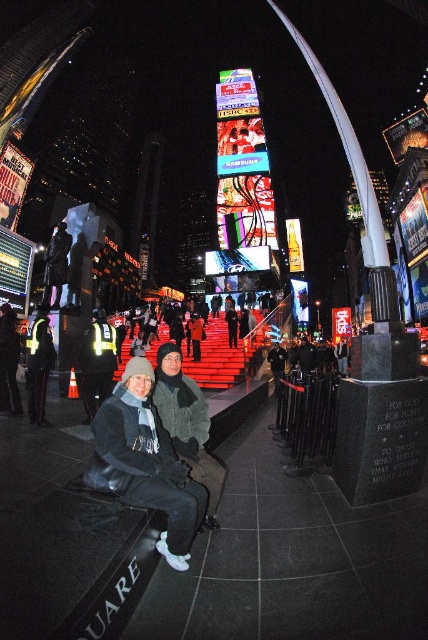
Question: Is dark gray knit hat at lower center positioned before reflective yellow vest at lower left?

Choices:
 (A) yes
 (B) no

Answer: (A)

Question: Does dark gray knit hat at lower center lie behind reflective yellow vest at lower left?

Choices:
 (A) yes
 (B) no

Answer: (B)

Question: Can you confirm if dark gray knit hat at lower center is positioned to the left of reflective yellow vest at lower left?

Choices:
 (A) no
 (B) yes

Answer: (A)

Question: Which of the following is the closest to the observer?

Choices:
 (A) dark gray knit hat at lower center
 (B) reflective yellow vest at lower left

Answer: (A)

Question: Among these points, which one is nearest to the camera?

Choices:
 (A) pyautogui.click(x=91, y=332)
 (B) pyautogui.click(x=175, y=476)

Answer: (B)